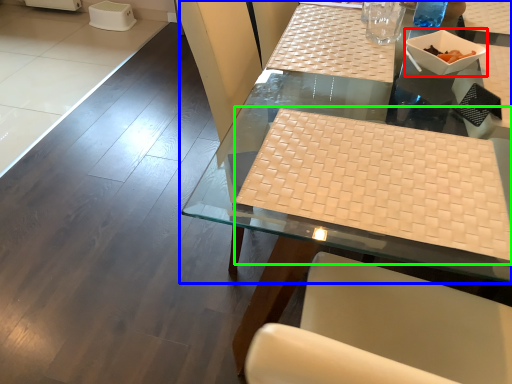
Question: Which object is positioned closest to bowl (highlighted by a red box)? Select from table (highlighted by a blue box) and wide (highlighted by a green box).

Choices:
 (A) table
 (B) wide

Answer: (A)